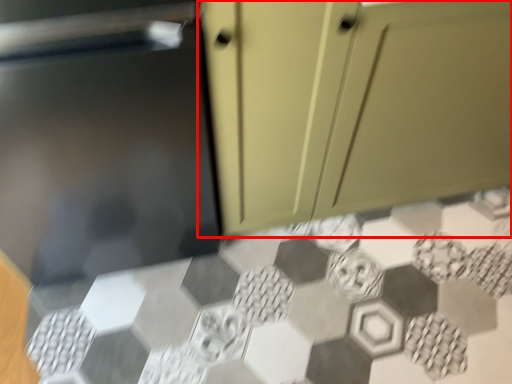
Question: From the image's perspective, what is the correct spatial positioning of cabinetry (annotated by the red box) in reference to ceramic tile?

Choices:
 (A) below
 (B) above

Answer: (B)